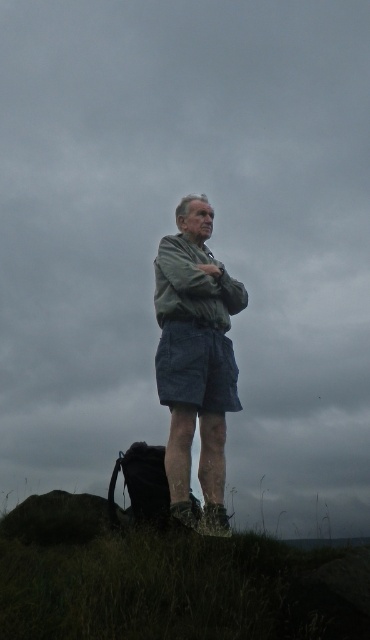
Question: Which point is farther to the camera?

Choices:
 (A) green fabric shirt at center
 (B) green grassy at lower center

Answer: (A)

Question: Does green grassy at lower center have a greater width compared to green fabric shirt at center?

Choices:
 (A) no
 (B) yes

Answer: (B)

Question: Is the position of green grassy at lower center less distant than that of green fabric shirt at center?

Choices:
 (A) yes
 (B) no

Answer: (A)

Question: Which point is farther to the camera?

Choices:
 (A) (48, 577)
 (B) (189, 298)

Answer: (B)

Question: Which of the following is the farthest from the observer?

Choices:
 (A) green grassy at lower center
 (B) green fabric shirt at center

Answer: (B)

Question: Is green grassy at lower center to the left of green fabric shirt at center from the viewer's perspective?

Choices:
 (A) no
 (B) yes

Answer: (B)